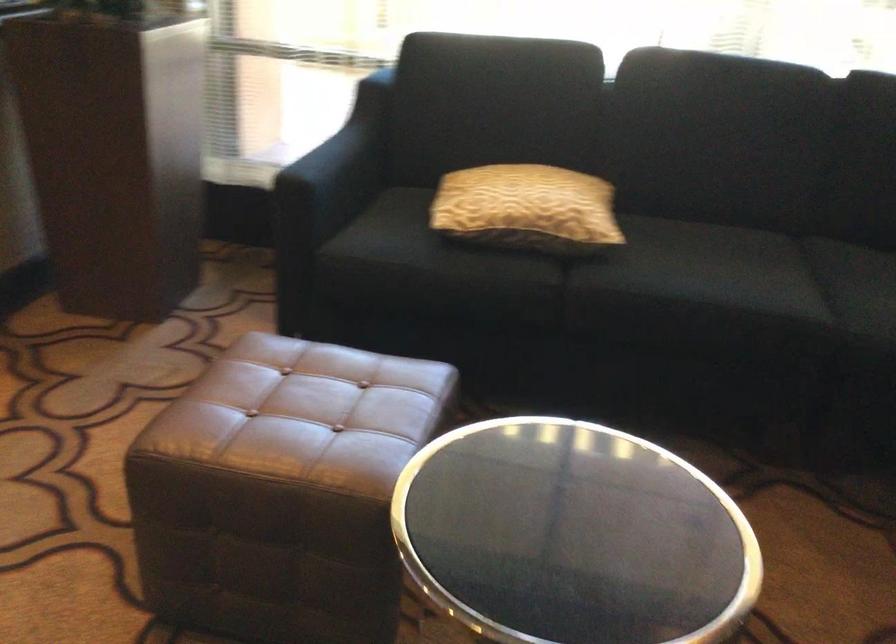
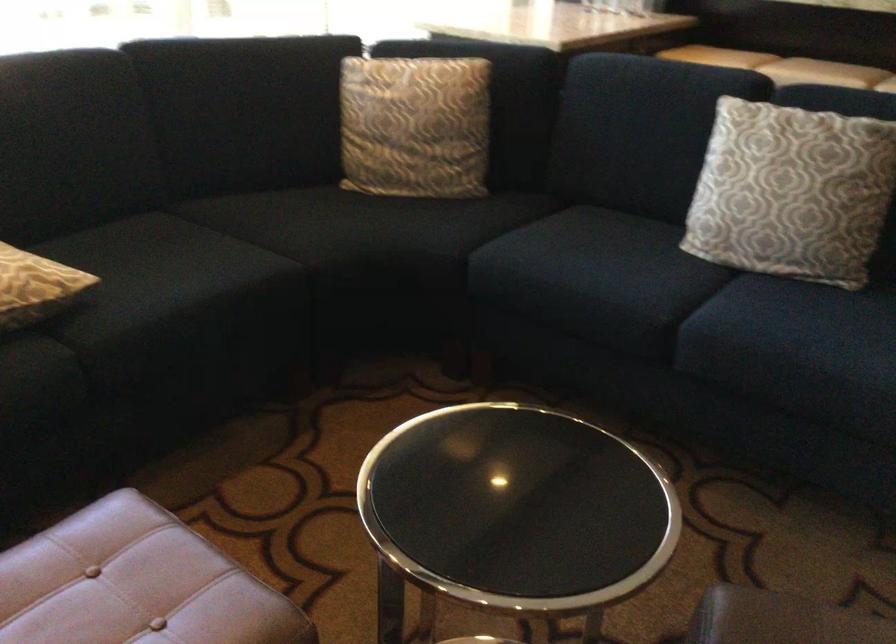
How did the camera likely rotate?

The camera's rotation is toward right-down.